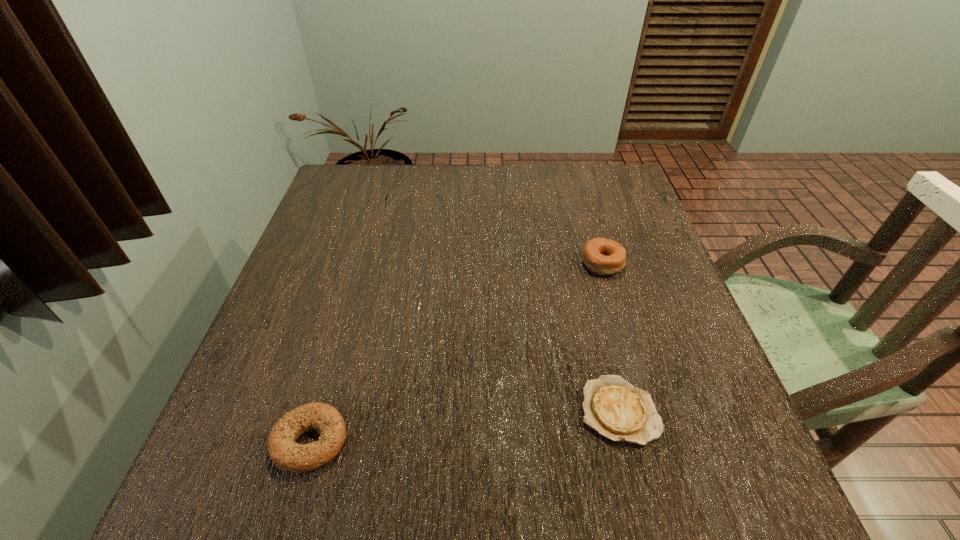
Find the location of a particular element. Image resolution: width=960 pixels, height=540 pixels. free space in the image that satisfies the following two spatial constraints: 1. in front of the lenses of the shortest object; 2. on the left side of the sunglasses is located at coordinates (324, 411).

Find the location of `free space in the image that satisfies the following two spatial constraints: 1. in front of the lenses of the shortest object; 2. on the left side of the sunglasses`. free space in the image that satisfies the following two spatial constraints: 1. in front of the lenses of the shortest object; 2. on the left side of the sunglasses is located at coordinates (324, 411).

Find the location of a particular element. The width and height of the screenshot is (960, 540). free location that satisfies the following two spatial constraints: 1. in front of the lenses of the farthest object; 2. on the right side of the right bagel is located at coordinates (365, 263).